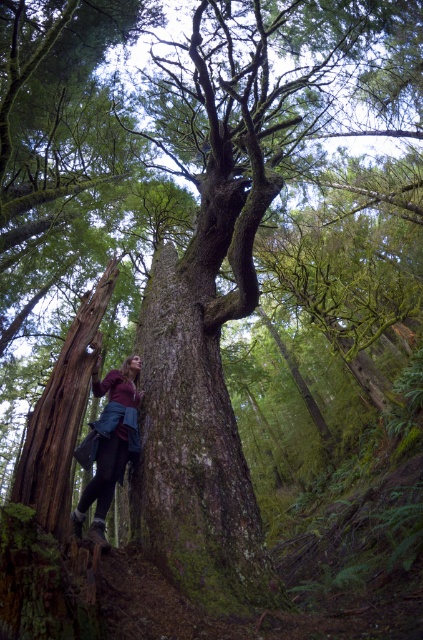
Is green mossy bark tree trunk at center smaller than maroon fabric jacket at lower left?

Actually, green mossy bark tree trunk at center might be larger than maroon fabric jacket at lower left.

Does green mossy bark tree trunk at center appear on the left side of maroon fabric jacket at lower left?

No, green mossy bark tree trunk at center is not to the left of maroon fabric jacket at lower left.

Does point (183, 368) come farther from viewer compared to point (109, 472)?

That is True.

Image resolution: width=423 pixels, height=640 pixels. I want to click on green mossy bark tree trunk at center, so click(x=195, y=444).